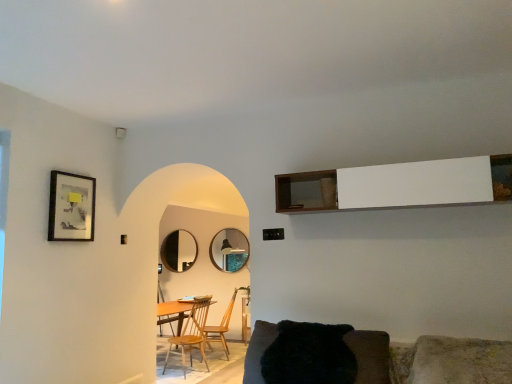
Question: Is matte black mirror at center, which is counted as the 2th mirror, starting from the front, bigger than matte silver mirror at center, which is the second mirror from back to front?

Choices:
 (A) yes
 (B) no

Answer: (B)

Question: Does matte black mirror at center, which is the 2th mirror in right-to-left order, appear on the left side of matte silver mirror at center, acting as the first mirror starting from the right?

Choices:
 (A) no
 (B) yes

Answer: (B)

Question: Is matte black mirror at center, the first mirror when ordered from left to right, positioned in front of matte silver mirror at center, which is the second mirror from back to front?

Choices:
 (A) yes
 (B) no

Answer: (B)

Question: Is matte silver mirror at center, the 1th mirror positioned from the front, a part of matte black mirror at center, which is counted as the 2th mirror, starting from the front?

Choices:
 (A) yes
 (B) no

Answer: (B)

Question: Does matte black mirror at center, which is counted as the 2th mirror, starting from the front, have a greater width compared to matte silver mirror at center, which is the second mirror in left-to-right order?

Choices:
 (A) yes
 (B) no

Answer: (B)

Question: Does point (454, 160) appear closer or farther from the camera than point (221, 322)?

Choices:
 (A) farther
 (B) closer

Answer: (B)

Question: Considering their positions, is white wood cabinet at upper center located in front of or behind wooden chair at center, the second chair positioned from the right?

Choices:
 (A) behind
 (B) front

Answer: (B)

Question: Considering the positions of white wood cabinet at upper center and wooden chair at center, acting as the second chair starting from the left, in the image, is white wood cabinet at upper center bigger or smaller than wooden chair at center, acting as the second chair starting from the left,?

Choices:
 (A) big
 (B) small

Answer: (B)

Question: Based on their positions, is white wood cabinet at upper center located to the left or right of wooden chair at center, the 1th chair viewed from the back?

Choices:
 (A) right
 (B) left

Answer: (A)

Question: Considering the positions of black furry chair at lower center, acting as the third chair starting from the back, and white wood cabinet at upper center in the image, is black furry chair at lower center, acting as the third chair starting from the back, taller or shorter than white wood cabinet at upper center?

Choices:
 (A) tall
 (B) short

Answer: (A)

Question: Considering their positions, is black furry chair at lower center, which appears as the third chair when viewed from the left, located in front of or behind white wood cabinet at upper center?

Choices:
 (A) front
 (B) behind

Answer: (A)

Question: Is point (254, 364) closer or farther from the camera than point (300, 198)?

Choices:
 (A) farther
 (B) closer

Answer: (B)

Question: From the image's perspective, is black furry chair at lower center, which is counted as the 1th chair, starting from the front, above or below white wood cabinet at upper center?

Choices:
 (A) below
 (B) above

Answer: (A)

Question: Considering the positions of point (86, 208) and point (245, 248), is point (86, 208) closer or farther from the camera than point (245, 248)?

Choices:
 (A) closer
 (B) farther

Answer: (A)

Question: Which is correct: matte black picture frame at upper left is inside matte silver mirror at center, which is the second mirror in left-to-right order, or outside of it?

Choices:
 (A) inside
 (B) outside

Answer: (B)